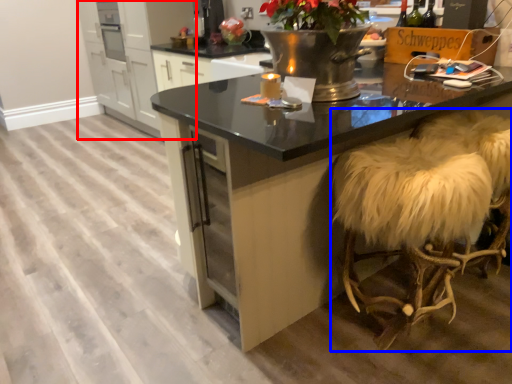
Question: Among these objects, which one is farthest to the camera, cabinetry (highlighted by a red box) or swivel chair (highlighted by a blue box)?

Choices:
 (A) cabinetry
 (B) swivel chair

Answer: (A)